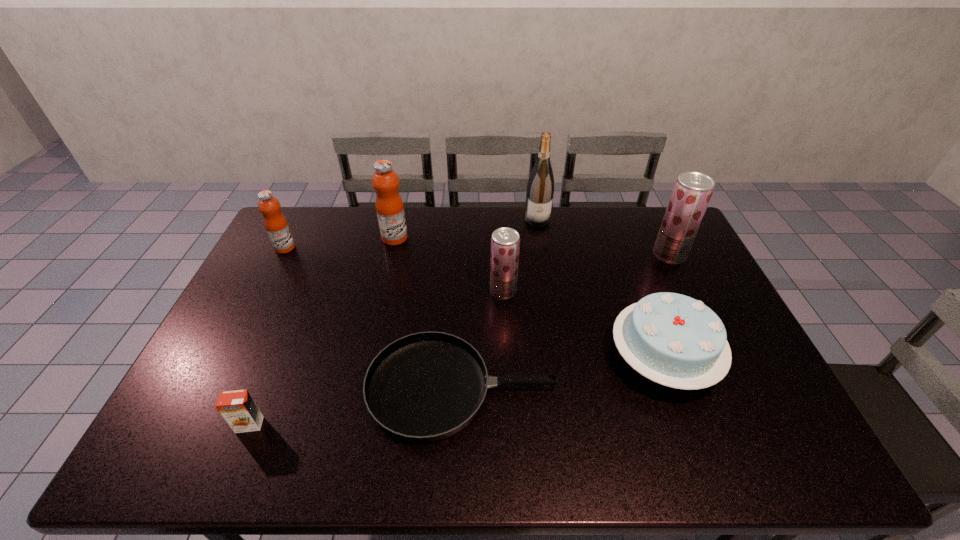
You are a GUI agent. You are given a task and a screenshot of the screen. Output one action in this format:
    pyautogui.click(x=<x>, y=<y>)
    Task: Click on the wine bottle
    This screenshot has width=960, height=540.
    Given the screenshot: What is the action you would take?
    pyautogui.click(x=540, y=189)

Identify the location of the farthest object. The height and width of the screenshot is (540, 960). (540, 189).

Find the location of a particular element. the bigger strawberry fruit juice is located at coordinates (692, 191).

At what (x,y) coordinates should I click in order to perform the action: click on the farther strawberry fruit juice. Please return your answer as a coordinate pair (x, y). Looking at the image, I should click on (692, 191).

This screenshot has width=960, height=540. Identify the location of the bigger orange fruit juice. (389, 206).

You are a GUI agent. You are given a task and a screenshot of the screen. Output one action in this format:
    pyautogui.click(x=<x>, y=<y>)
    Task: Click on the right orange fruit juice
    Image resolution: width=960 pixels, height=540 pixels.
    Given the screenshot: What is the action you would take?
    pyautogui.click(x=389, y=206)

This screenshot has height=540, width=960. I want to click on the third fruit juice from left to right, so click(505, 242).

I want to click on the nearer strawberry fruit juice, so click(505, 242).

The image size is (960, 540). In order to click on the leftmost object in this screenshot , I will do `click(276, 225)`.

Locate an element on the screen. Image resolution: width=960 pixels, height=540 pixels. the leftmost fruit juice is located at coordinates (276, 225).